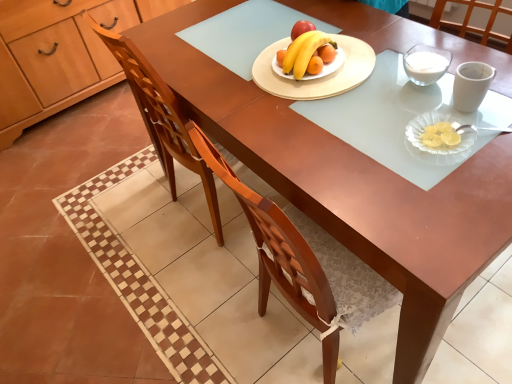
At what (x,y) coordinates should I click in order to perform the action: click on vacant space that's between clear glass platter at lower right, placed as the 1th platter when sorted from right to left, and yellow matte banana at center. Please return your answer as a coordinate pair (x, y). The width and height of the screenshot is (512, 384). Looking at the image, I should click on (369, 101).